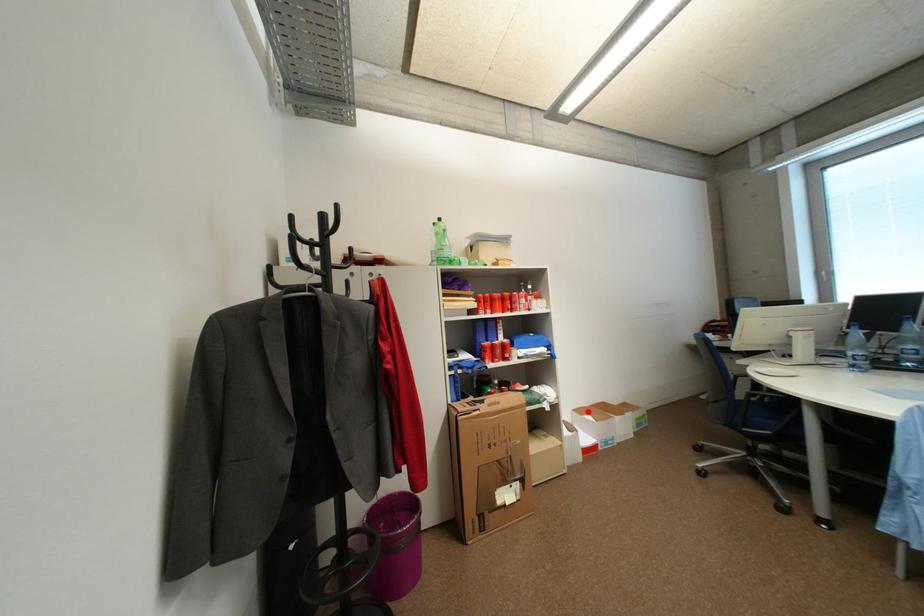
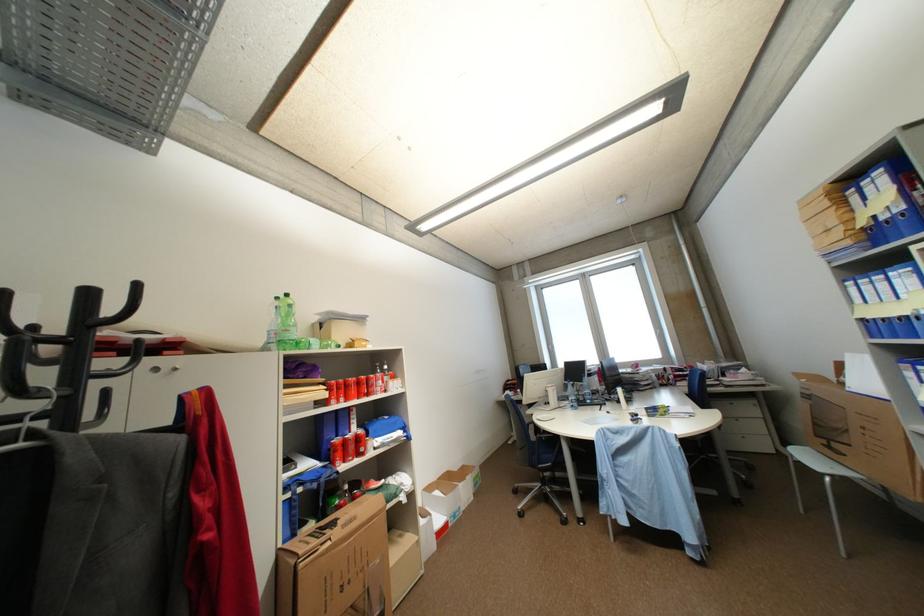
Question: I am providing you with two images of the same scene from different viewpoints. Image1 has a red point marked. In image2, the corresponding 3D location appears at what relative position? Reply with the corresponding letter.

Choices:
 (A) Closer
 (B) Farther

Answer: (A)